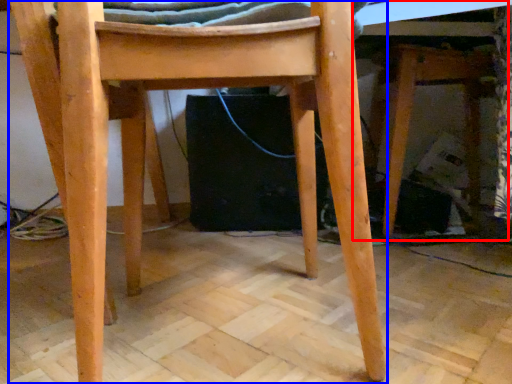
Question: Which object is closer to the camera taking this photo, table (highlighted by a red box) or chair (highlighted by a blue box)?

Choices:
 (A) table
 (B) chair

Answer: (B)